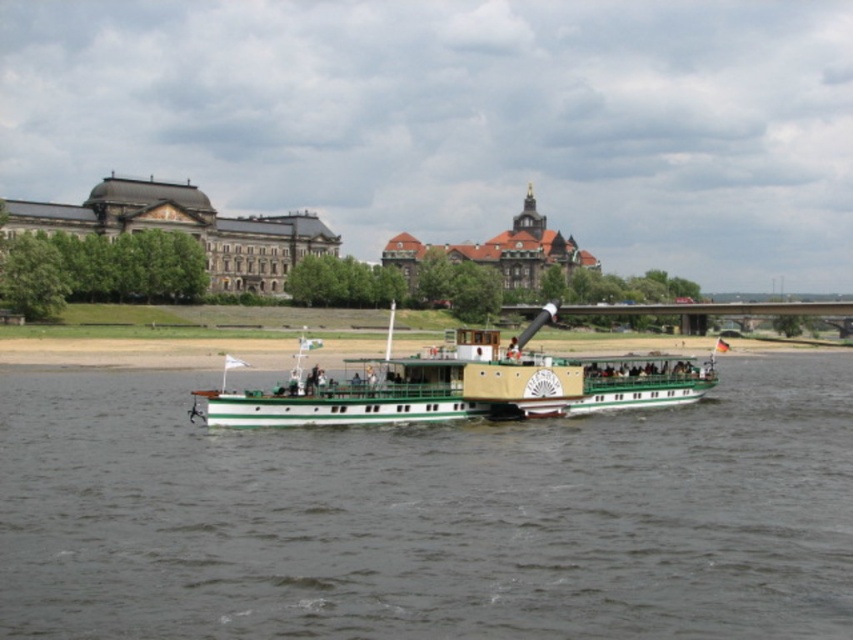
Question: Which of the following is the closest to the observer?

Choices:
 (A) (393, 611)
 (B) (637, 362)

Answer: (A)

Question: Observing the image, what is the correct spatial positioning of green matte boat at center in reference to green polished wood boat at center?

Choices:
 (A) above
 (B) below

Answer: (B)

Question: Can you confirm if green matte boat at center is wider than green polished wood boat at center?

Choices:
 (A) yes
 (B) no

Answer: (A)

Question: Which object appears closest to the camera in this image?

Choices:
 (A) green matte boat at center
 (B) green polished wood boat at center

Answer: (A)

Question: Is green matte boat at center wider than green polished wood boat at center?

Choices:
 (A) no
 (B) yes

Answer: (B)